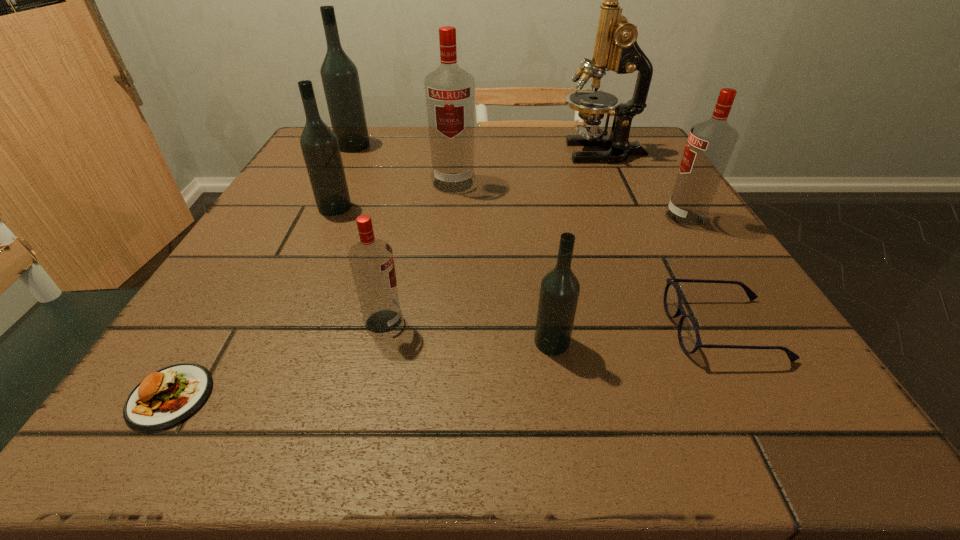
Locate an element on the screen. The width and height of the screenshot is (960, 540). the second vodka from right to left is located at coordinates (559, 291).

The image size is (960, 540). Find the location of `the rightmost black vodka`. the rightmost black vodka is located at coordinates (559, 291).

Locate an element on the screen. the second shortest object is located at coordinates (689, 338).

Locate an element on the screen. The height and width of the screenshot is (540, 960). patty (food) is located at coordinates (164, 398).

Locate an element on the screen. The width and height of the screenshot is (960, 540). vacant region located 0.300m at the eyepiece of the gray microscope is located at coordinates (434, 152).

Locate an element on the screen. The width and height of the screenshot is (960, 540). free region located 0.050m at the eyepiece of the gray microscope is located at coordinates (538, 152).

This screenshot has height=540, width=960. I want to click on free space located at the eyepiece of the gray microscope, so click(x=426, y=152).

You are a GUI agent. You are given a task and a screenshot of the screen. Output one action in this format:
    pyautogui.click(x=<x>, y=<y>)
    Task: Click on the blank space located on the back of the biggest black vodka
    
    Given the screenshot: What is the action you would take?
    pyautogui.click(x=361, y=131)

The image size is (960, 540). Find the location of `vacant point located 0.330m on the front label of the fifth nearest vodka`. vacant point located 0.330m on the front label of the fifth nearest vodka is located at coordinates (443, 306).

The width and height of the screenshot is (960, 540). I want to click on free location located on the front label of the rightmost red vodka, so click(x=597, y=218).